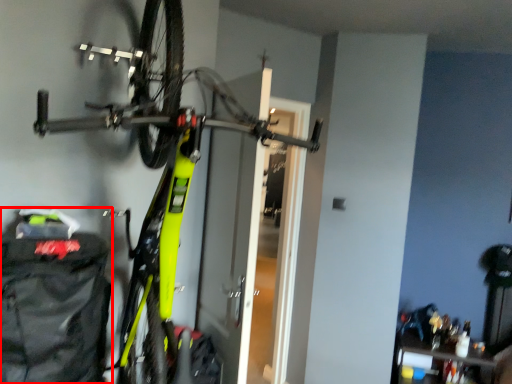
Question: Observing the image, what is the correct spatial positioning of backpack (annotated by the red box) in reference to bicycle?

Choices:
 (A) left
 (B) right

Answer: (A)